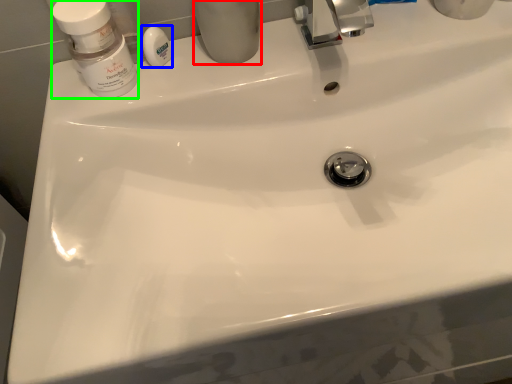
Question: Based on their relative distances, which object is farther from toiletry (highlighted by a red box)? Choose from soap (highlighted by a blue box) and mouthwash (highlighted by a green box).

Choices:
 (A) soap
 (B) mouthwash

Answer: (B)